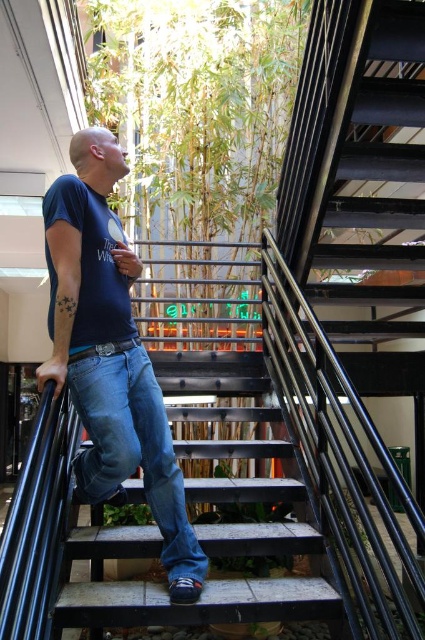
Question: Can you confirm if blue denim jeans at center is positioned below blue cotton t-shirt at center?

Choices:
 (A) no
 (B) yes

Answer: (B)

Question: Which of the following is the closest to the observer?

Choices:
 (A) (176, 506)
 (B) (87, 275)
 (C) (56, 180)

Answer: (C)

Question: Which point is closer to the camera?

Choices:
 (A) [x=116, y=294]
 (B) [x=73, y=316]
 (C) [x=121, y=422]

Answer: (B)

Question: Does denim at center have a smaller size compared to blue cotton t-shirt at center?

Choices:
 (A) yes
 (B) no

Answer: (B)

Question: Which object is farther from the camera taking this photo?

Choices:
 (A) denim at center
 (B) blue denim jeans at center

Answer: (A)

Question: Does blue denim jeans at center appear over blue cotton t-shirt at center?

Choices:
 (A) no
 (B) yes

Answer: (A)